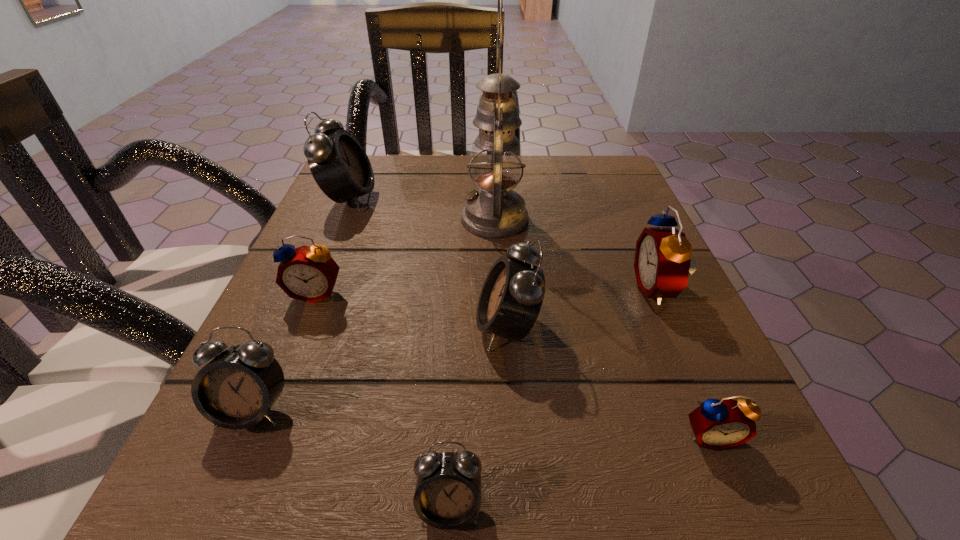
Where is `oil lamp`? oil lamp is located at coordinates (495, 211).

This screenshot has width=960, height=540. I want to click on gray oil lamp, so click(x=495, y=211).

I want to click on the seventh shortest object, so click(340, 166).

This screenshot has width=960, height=540. What are the coordinates of `the biggest white alarm clock` in the screenshot? It's located at (340, 166).

The image size is (960, 540). What are the coordinates of `the biggest red alarm clock` in the screenshot? It's located at (662, 263).

Locate an element on the screen. The height and width of the screenshot is (540, 960). the third nearest white alarm clock is located at coordinates (511, 298).

At what (x,y) coordinates should I click in order to perform the action: click on the leftmost red alarm clock. Please return your answer as a coordinate pair (x, y). Looking at the image, I should click on (309, 274).

I want to click on the third farthest white alarm clock, so click(x=235, y=390).

Where is `the smallest red alarm clock`? The width and height of the screenshot is (960, 540). the smallest red alarm clock is located at coordinates (718, 424).

Where is `the nearest white alarm clock`? the nearest white alarm clock is located at coordinates (448, 494).